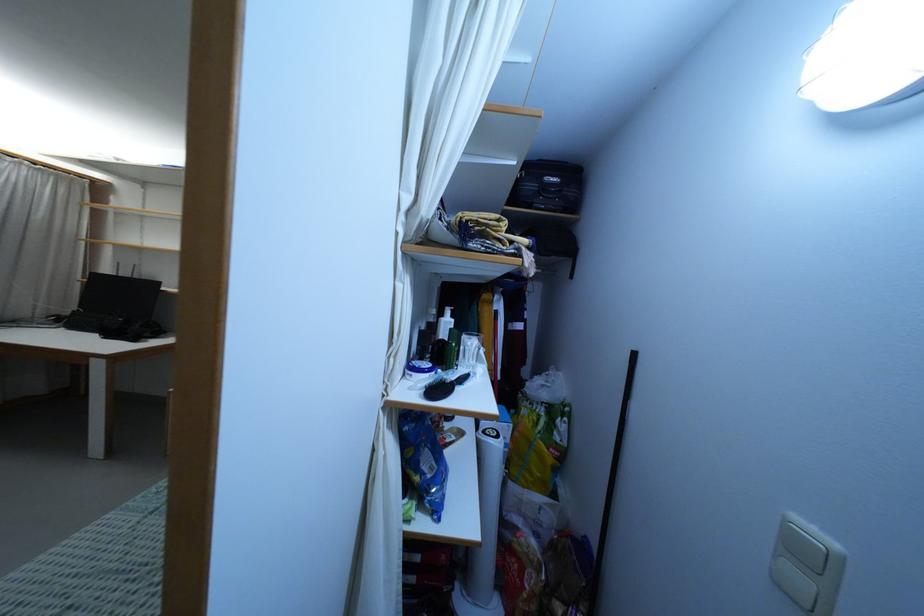
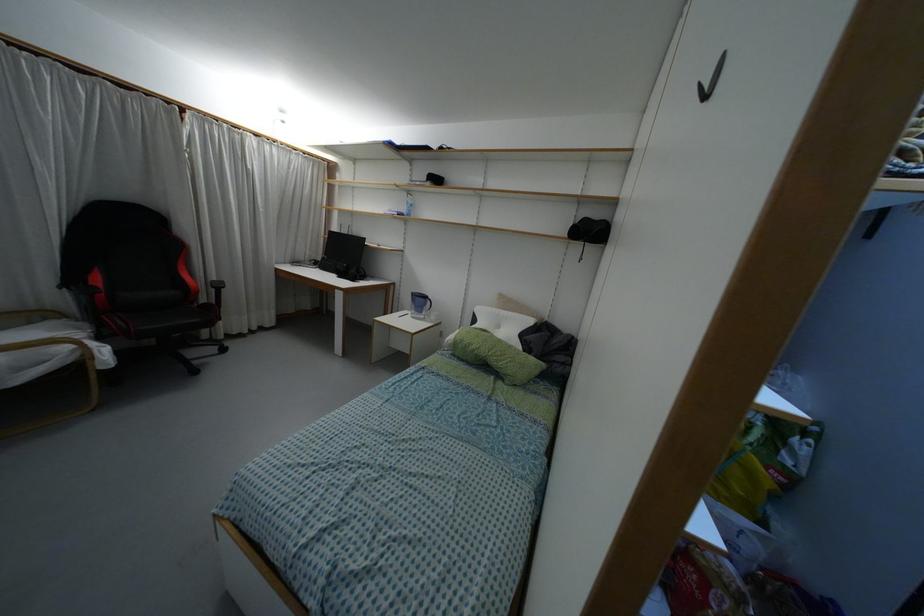
Question: In a continuous first-person perspective shot, in which direction is the camera moving?

Choices:
 (A) Left
 (B) Right
 (C) Forward
 (D) Backward

Answer: (A)